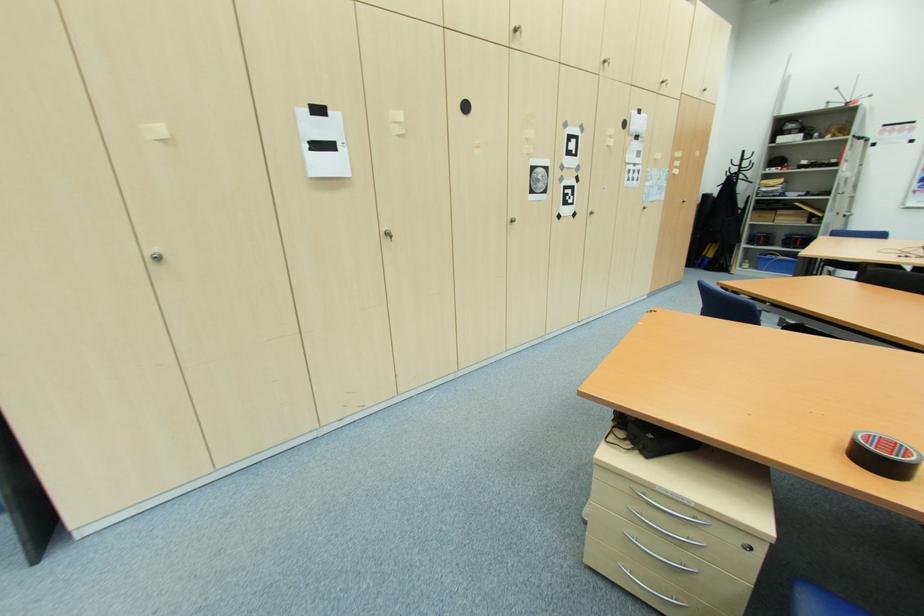
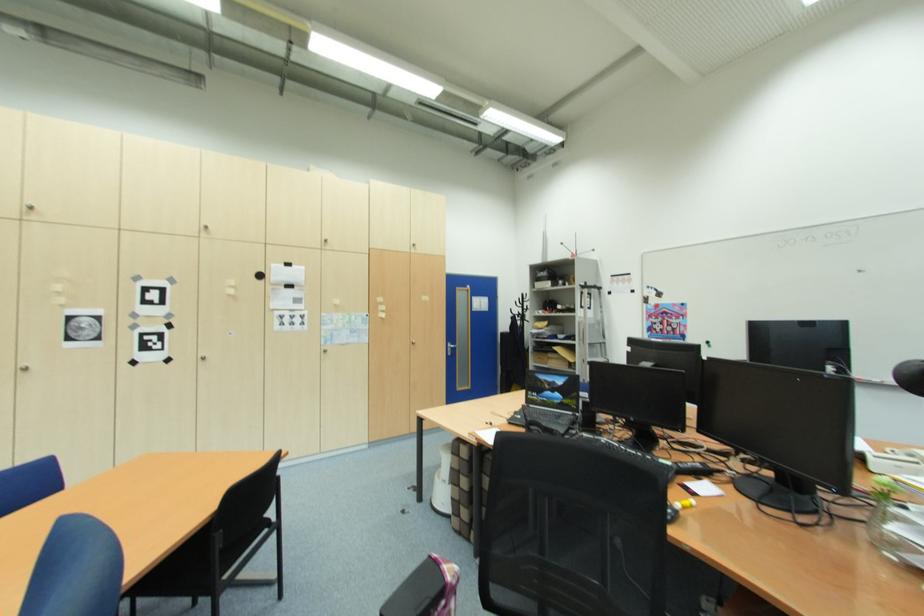
Find the pixel in the second image that matches pixel 596 214 in the first image.

(208, 360)